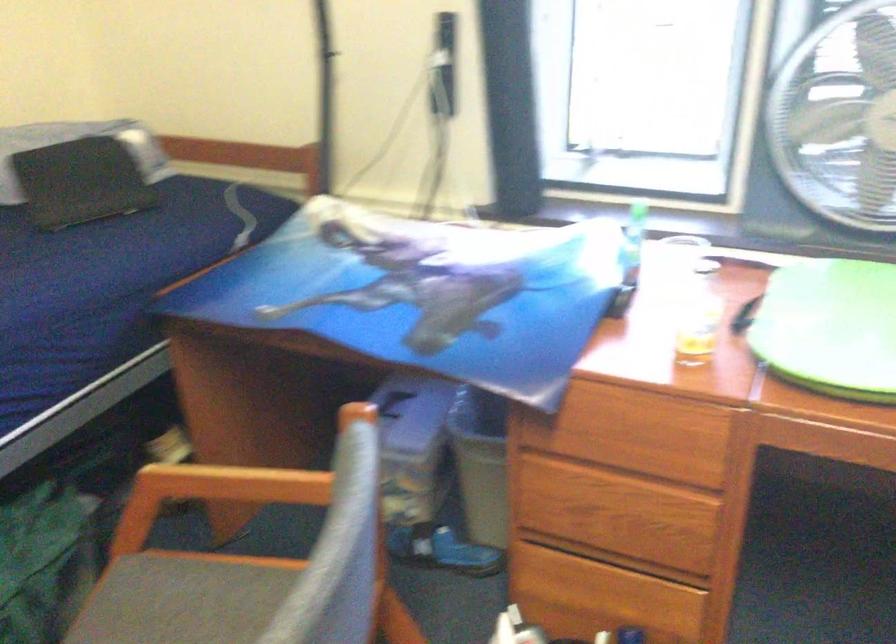
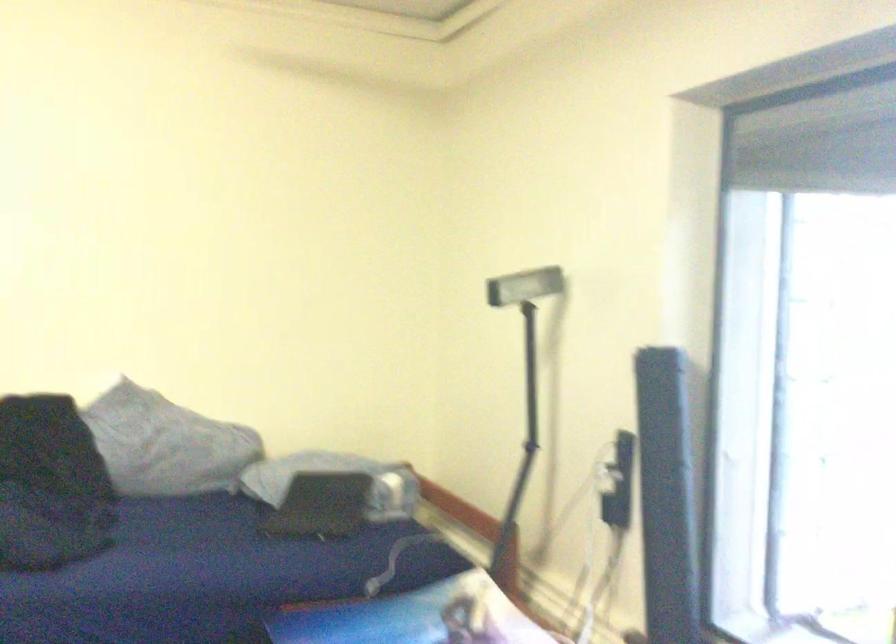
First-person continuous shooting, in which direction is the camera rotating?

The camera rotated toward left-up.